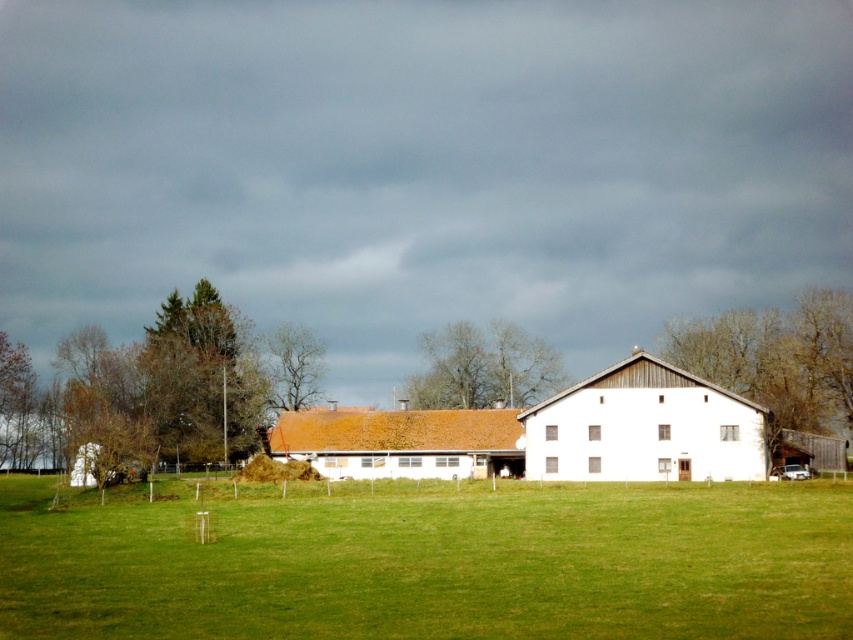
You are standing at the edge of the field looking towards the brown shingle roof at center and the bare branches at upper center. If you want to place a 10 meter long fence between them, will there be enough space?

The distance between the brown shingle roof at center and the bare branches at upper center is 25.09 meters. Since the fence is only 10 meters long, there is sufficient space to place it between them.

You are standing in the rural scene and want to walk from the point closer to you to the point farther away. Which path would you take between the two points, point (809, 308) and point (428, 349)?

You should walk from point (809, 308) to point (428, 349) because point (809, 308) is closer to the viewer and the other point is farther away.